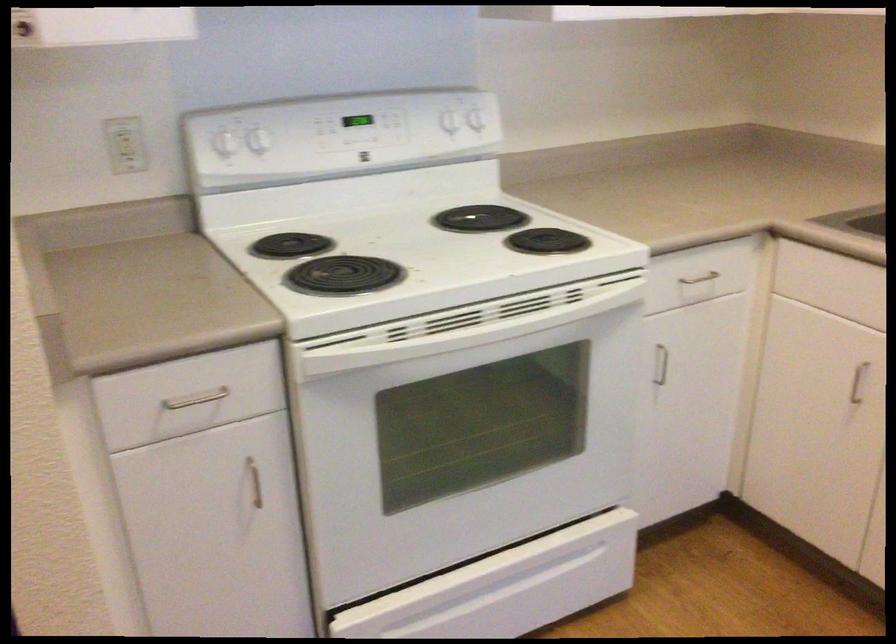
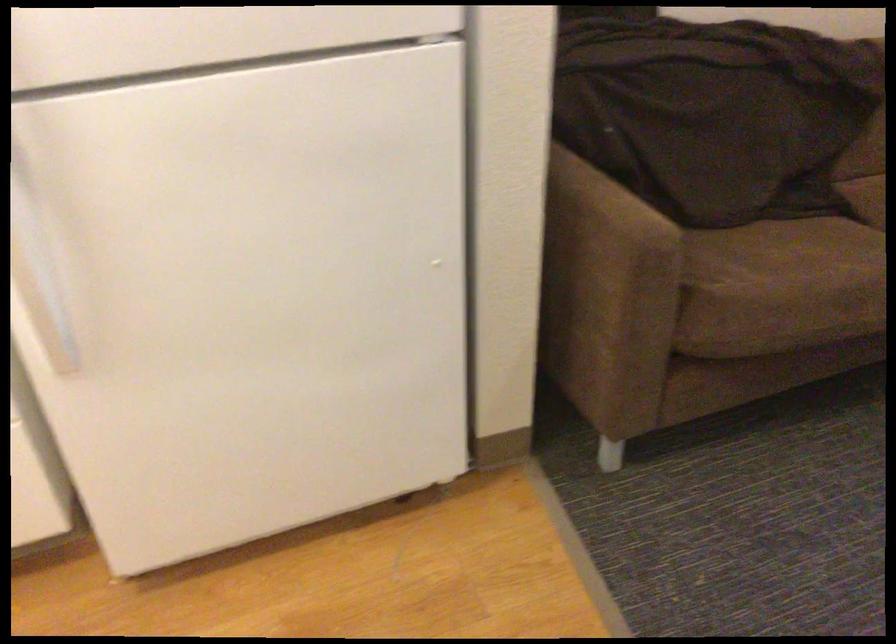
The images are taken continuously from a first-person perspective. In which direction is your viewpoint rotating?

The rotation direction of the camera is right-down.